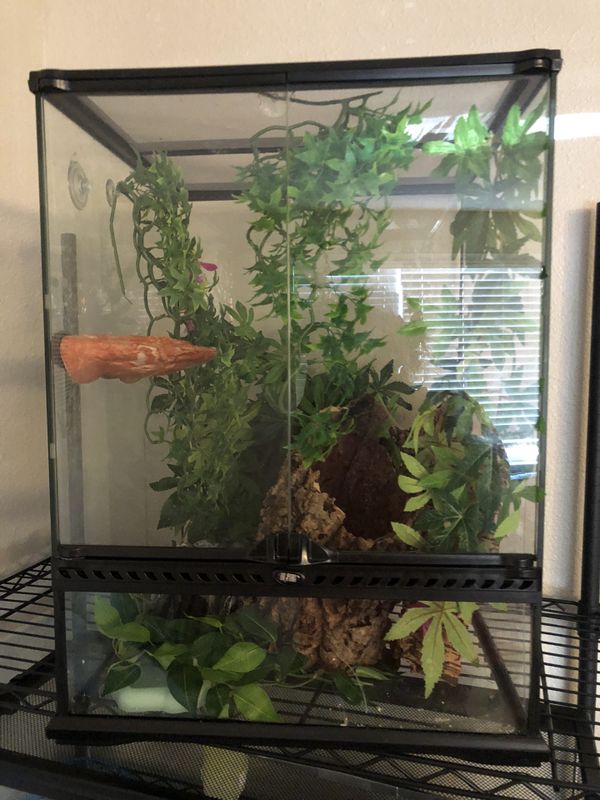
This screenshot has height=800, width=600. I want to click on ceiling, so click(x=236, y=37).